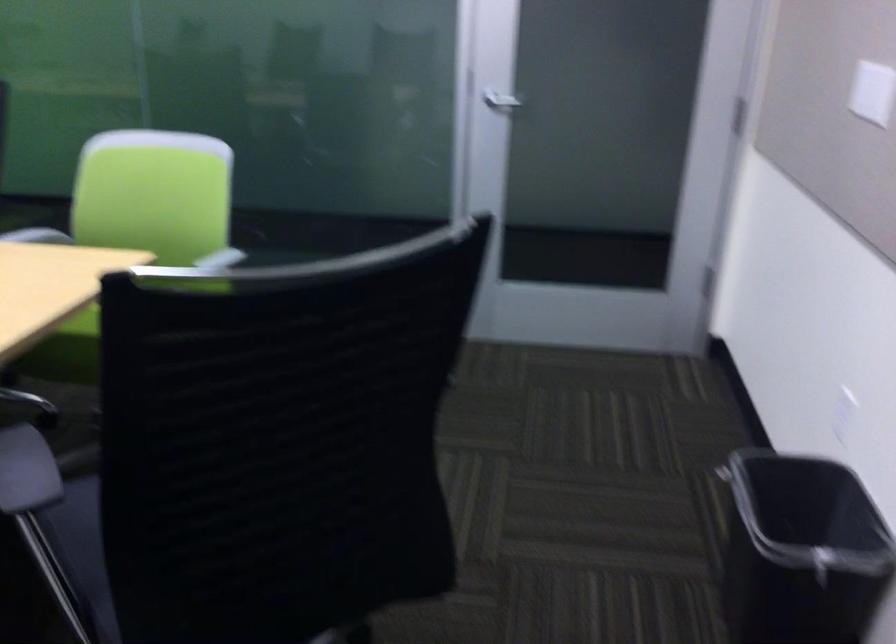
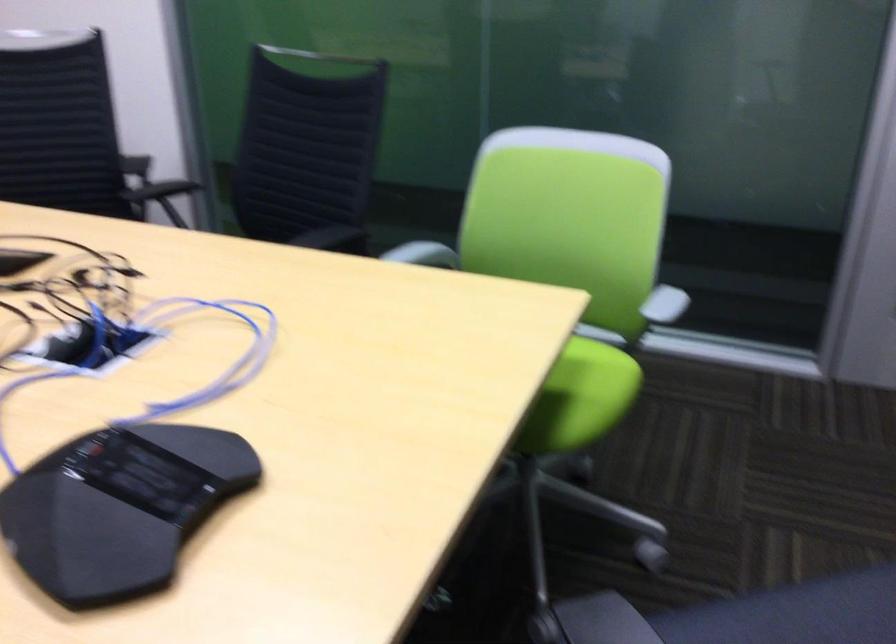
Locate, in the second image, the point that corresponds to (224,261) in the first image.

(659, 310)